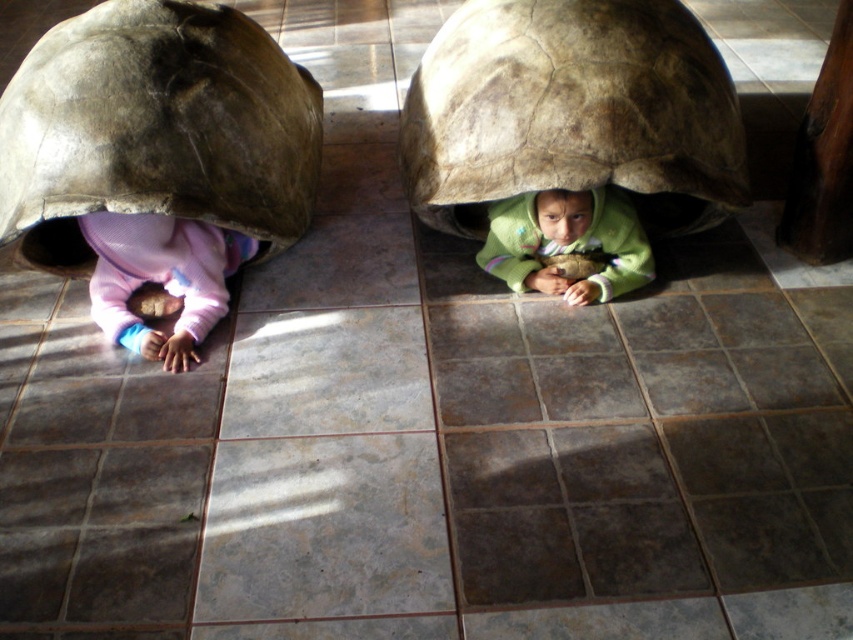
Does matte brown tortoise shell at lower left appear on the left side of pink fleece baby at lower left?

Incorrect, matte brown tortoise shell at lower left is not on the left side of pink fleece baby at lower left.

In the scene shown: Can you confirm if matte brown tortoise shell at lower left is positioned above pink fleece baby at lower left?

Indeed, matte brown tortoise shell at lower left is positioned over pink fleece baby at lower left.

Which is in front, point (233, 163) or point (231, 268)?

Positioned in front is point (233, 163).

Locate an element on the screen. The height and width of the screenshot is (640, 853). matte brown tortoise shell at lower left is located at coordinates (155, 129).

Is matte brown tortoise shell at lower left thinner than leather-like brown tortoise shell at center?

Result: Correct, matte brown tortoise shell at lower left's width is less than leather-like brown tortoise shell at center's.

Can you confirm if matte brown tortoise shell at lower left is smaller than leather-like brown tortoise shell at center?

Incorrect, matte brown tortoise shell at lower left is not smaller in size than leather-like brown tortoise shell at center.

Where is `matte brown tortoise shell at lower left`? The height and width of the screenshot is (640, 853). matte brown tortoise shell at lower left is located at coordinates (155, 129).

I want to click on matte brown tortoise shell at lower left, so click(x=155, y=129).

Does pink fleece baby at lower left appear on the left side of green fleece jacket at center?

Indeed, pink fleece baby at lower left is positioned on the left side of green fleece jacket at center.

Does pink fleece baby at lower left have a larger size compared to green fleece jacket at center?

Yes.

The width and height of the screenshot is (853, 640). What do you see at coordinates (161, 276) in the screenshot?
I see `pink fleece baby at lower left` at bounding box center [161, 276].

This screenshot has width=853, height=640. In order to click on pink fleece baby at lower left in this screenshot , I will do `click(161, 276)`.